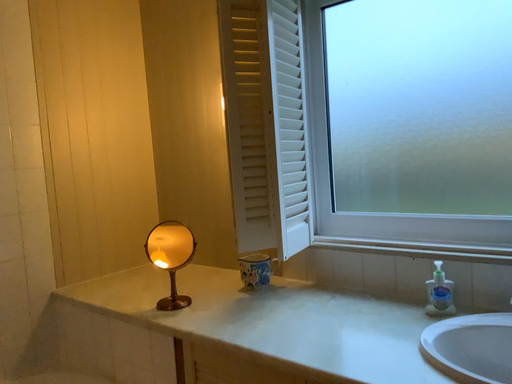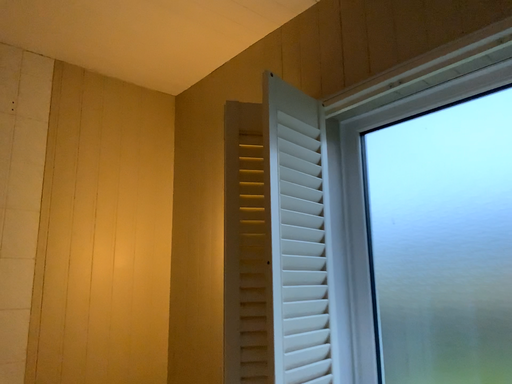
Question: Which way did the camera rotate in the video?

Choices:
 (A) rotated upward
 (B) rotated downward

Answer: (A)